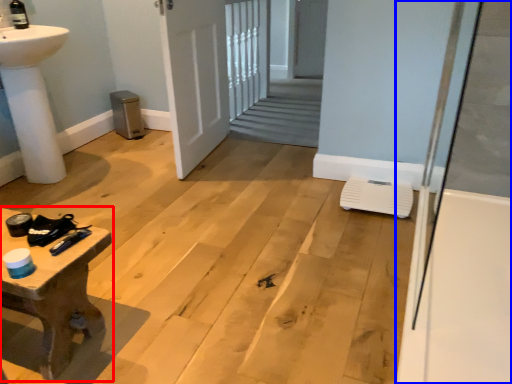
Question: Which point is closer to the camera, table (highlighted by a red box) or bath (highlighted by a blue box)?

Choices:
 (A) table
 (B) bath

Answer: (B)